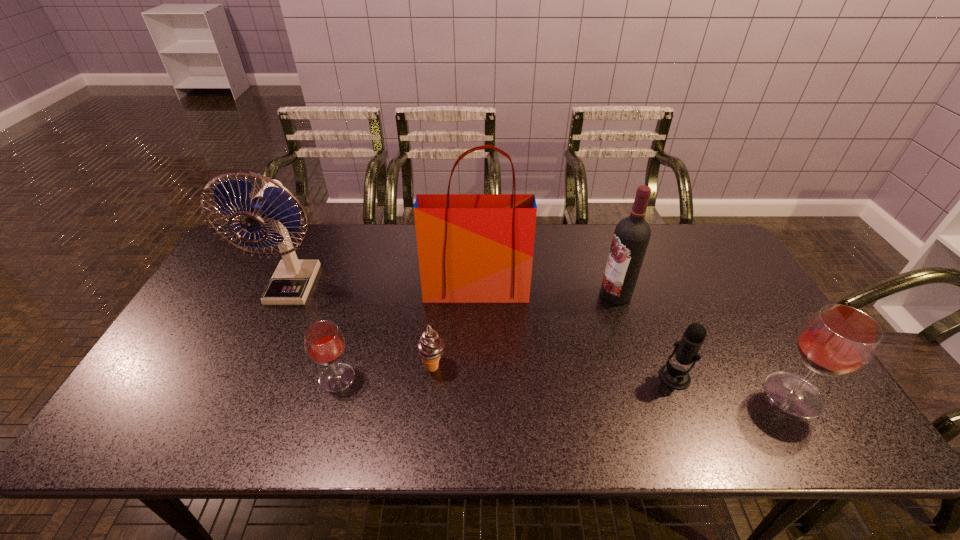
Where is `vacant spot for a new wineglass to ensure equal spacing`? Image resolution: width=960 pixels, height=540 pixels. vacant spot for a new wineglass to ensure equal spacing is located at coordinates (562, 386).